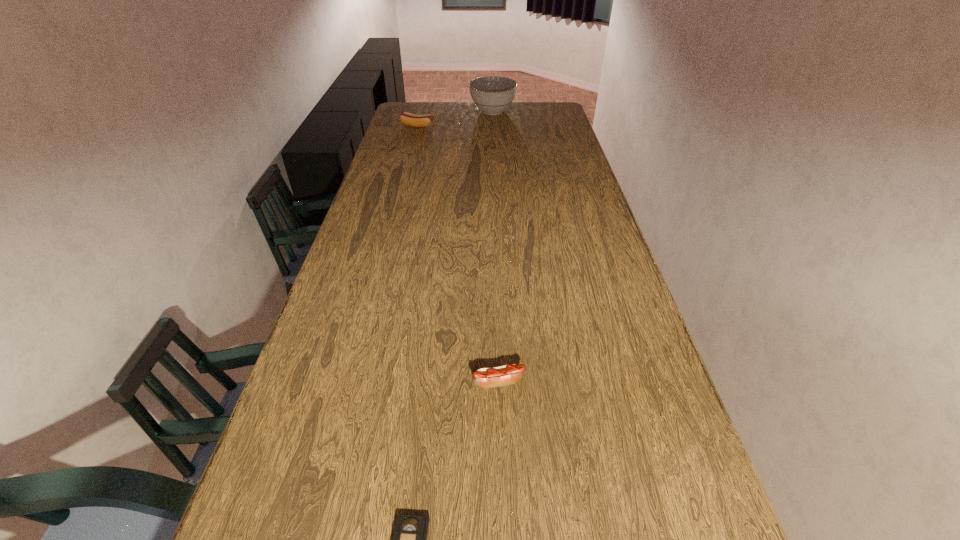
Identify the location of object present at the left edge. The height and width of the screenshot is (540, 960). (410, 119).

Locate an element on the screen. The width and height of the screenshot is (960, 540). vacant region at the far edge is located at coordinates (455, 115).

In the image, there is a desktop. At what (x,y) coordinates should I click in order to perform the action: click on blank space at the left edge. Please return your answer as a coordinate pair (x, y). The width and height of the screenshot is (960, 540). Looking at the image, I should click on (417, 130).

Identify the location of free space at the right edge. (612, 268).

Locate an element on the screen. The image size is (960, 540). free space between the farther sausage and the third tallest object is located at coordinates (458, 254).

I want to click on vacant area between the chinaware and the second farthest object, so click(x=455, y=118).

Locate an element on the screen. This screenshot has height=540, width=960. free space between the tallest object and the shorter sausage is located at coordinates (495, 247).

Identify the location of empty space that is in between the third nearest object and the third farthest object. (458, 254).

I want to click on free space that is in between the chinaware and the left sausage, so click(455, 118).

The width and height of the screenshot is (960, 540). Identify the location of free space between the farthest object and the second farthest object. (455, 118).